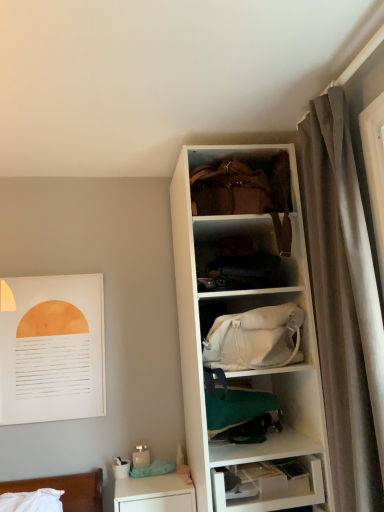
This screenshot has width=384, height=512. Identify the location of empty space that is ontop of white glossy table at lower left (from a real-world perspective). (151, 480).